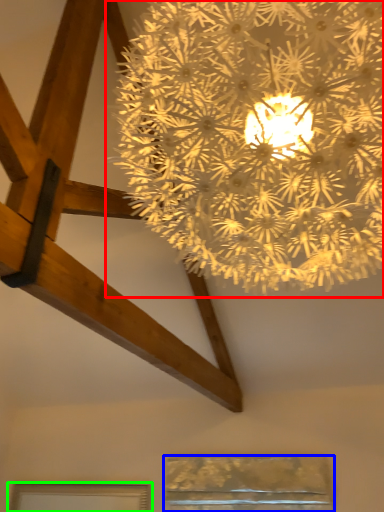
Question: Which is farther away from lamp (highlighted by a red box)? window (highlighted by a blue box) or window (highlighted by a green box)?

Choices:
 (A) window
 (B) window

Answer: (B)